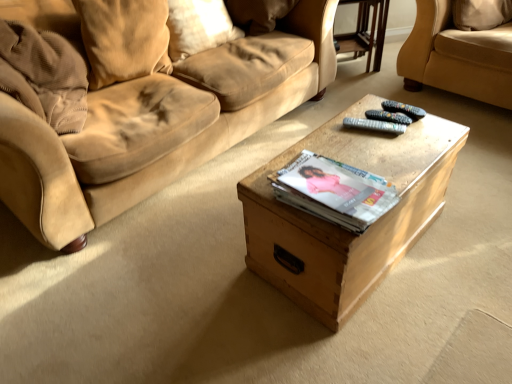
Where is `free space above wooden box at center (from a real-world perspective)`? The image size is (512, 384). free space above wooden box at center (from a real-world perspective) is located at coordinates (358, 132).